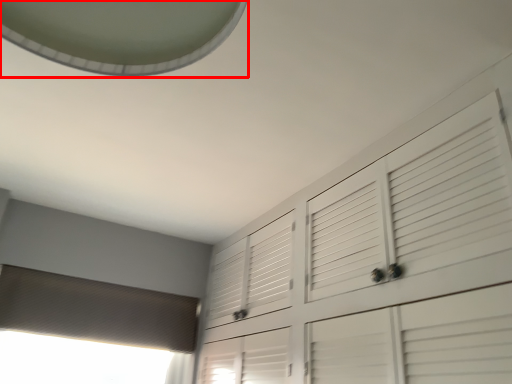
Question: From the image's perspective, what is the correct spatial positioning of exhaust hood (annotated by the red box) in reference to blind?

Choices:
 (A) above
 (B) below

Answer: (A)